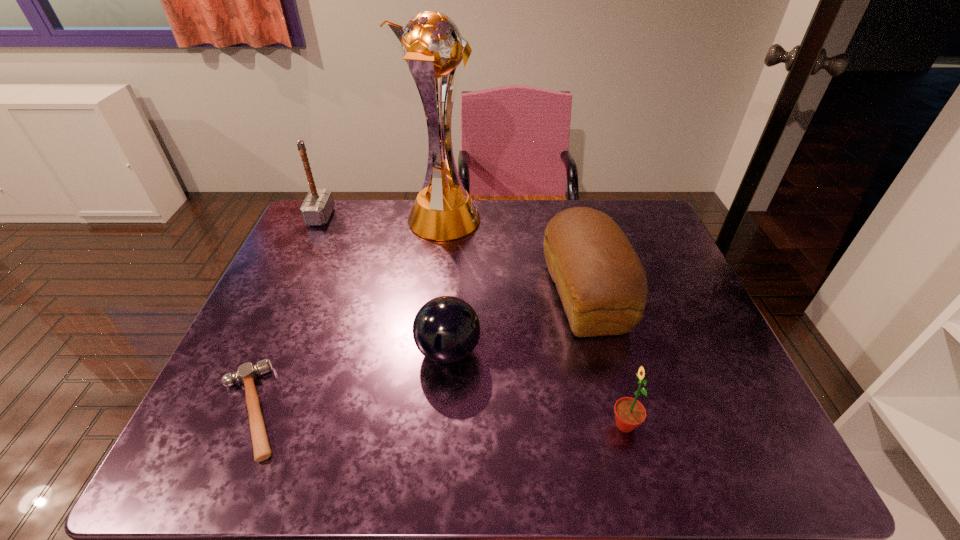
You are a GUI agent. You are given a task and a screenshot of the screen. Output one action in this format:
    pyautogui.click(x=<x>, y=<y>)
    Task: Click on the free point located 0.060m on the front of the bread
    The width and height of the screenshot is (960, 540).
    Given the screenshot: What is the action you would take?
    pyautogui.click(x=603, y=367)

Where is `free space located on the face of the sunflower`? Image resolution: width=960 pixels, height=540 pixels. free space located on the face of the sunflower is located at coordinates (449, 424).

I want to click on vacant space located 0.290m on the face of the sunflower, so click(x=465, y=424).

Identify the location of vacant space located 0.270m on the face of the sunflower. (474, 424).

Find the location of a particular element. vacant space located on the side of the second shortest object with the finger holes is located at coordinates (528, 351).

Locate an element on the screen. free space located on the right of the nearer hammer is located at coordinates pyautogui.click(x=426, y=410).

Where is `trophy that is positioned at the far edge`? The height and width of the screenshot is (540, 960). trophy that is positioned at the far edge is located at coordinates (431, 44).

Where is `hammer located at the far edge`? This screenshot has width=960, height=540. hammer located at the far edge is located at coordinates (318, 205).

Find the location of `sunflower located in the near edge section of the desktop`. sunflower located in the near edge section of the desktop is located at coordinates (629, 413).

The width and height of the screenshot is (960, 540). What are the coordinates of `hammer present at the near edge` in the screenshot? It's located at (247, 373).